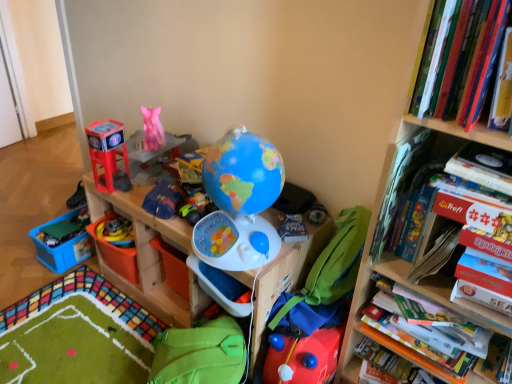
Question: From a real-world perspective, is blue plastic globe at center on top of hardcover book at upper right, marked as the second book in a bottom-to-top arrangement?

Choices:
 (A) yes
 (B) no

Answer: (B)

Question: Considering the relative sizes of blue plastic globe at center and hardcover book at upper right, marked as the second book in a bottom-to-top arrangement, in the image provided, is blue plastic globe at center wider than hardcover book at upper right, marked as the second book in a bottom-to-top arrangement,?

Choices:
 (A) no
 (B) yes

Answer: (B)

Question: Is blue plastic globe at center outside hardcover book at upper right, the second book positioned from the top?

Choices:
 (A) yes
 (B) no

Answer: (A)

Question: Considering the relative positions of blue plastic globe at center and hardcover book at upper right, marked as the second book in a bottom-to-top arrangement, in the image provided, is blue plastic globe at center behind hardcover book at upper right, marked as the second book in a bottom-to-top arrangement,?

Choices:
 (A) yes
 (B) no

Answer: (A)

Question: From a real-world perspective, is blue plastic globe at center located beneath hardcover book at upper right, marked as the second book in a bottom-to-top arrangement?

Choices:
 (A) no
 (B) yes

Answer: (B)

Question: Considering the relative sizes of blue plastic globe at center and hardcover book at upper right, marked as the second book in a bottom-to-top arrangement, in the image provided, is blue plastic globe at center bigger than hardcover book at upper right, marked as the second book in a bottom-to-top arrangement,?

Choices:
 (A) yes
 (B) no

Answer: (A)

Question: Is matte plastic toy at left, the 6th toy from the bottom, placed right next to matte blue fabric bag at center, which is the 2th toy from top to bottom?

Choices:
 (A) no
 (B) yes

Answer: (A)

Question: Considering the relative positions of matte plastic toy at left, the 6th toy from the bottom, and matte blue fabric bag at center, which is the 2th toy from top to bottom, in the image provided, is matte plastic toy at left, the 6th toy from the bottom, behind matte blue fabric bag at center, which is the 2th toy from top to bottom,?

Choices:
 (A) no
 (B) yes

Answer: (B)

Question: From a real-world perspective, is matte plastic toy at left, which is the 4th toy from right to left, physically below matte blue fabric bag at center, the 4th toy when ordered from left to right?

Choices:
 (A) no
 (B) yes

Answer: (A)

Question: Does matte plastic toy at left, which is the 4th toy from right to left, appear on the left side of matte blue fabric bag at center, which is counted as the 5th toy, starting from the bottom?

Choices:
 (A) yes
 (B) no

Answer: (A)

Question: Is matte plastic toy at left, acting as the first toy starting from the top, oriented towards matte blue fabric bag at center, which is the 2th toy from top to bottom?

Choices:
 (A) no
 (B) yes

Answer: (A)

Question: Can you confirm if matte plastic toy at left, which is the 4th toy from right to left, is thinner than matte blue fabric bag at center, the 4th toy when ordered from left to right?

Choices:
 (A) no
 (B) yes

Answer: (B)

Question: Considering the relative positions of green plastic toy at lower left, which appears as the first toy when viewed from the left, and matte blue fabric bag at center, the 4th toy when ordered from left to right, in the image provided, is green plastic toy at lower left, which appears as the first toy when viewed from the left, in front of matte blue fabric bag at center, the 4th toy when ordered from left to right,?

Choices:
 (A) no
 (B) yes

Answer: (A)